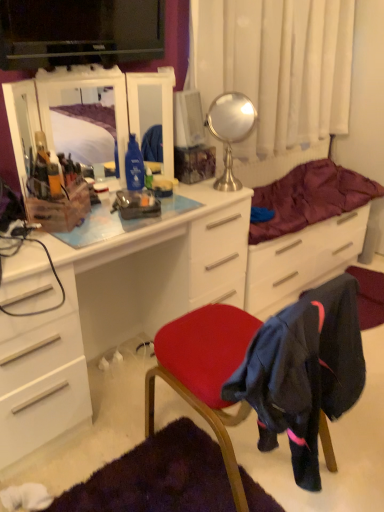
The width and height of the screenshot is (384, 512). What are the coordinates of `velvet red chair at center` in the screenshot? It's located at (268, 373).

This screenshot has height=512, width=384. What do you see at coordinates (79, 32) in the screenshot?
I see `matte black television at upper center` at bounding box center [79, 32].

Image resolution: width=384 pixels, height=512 pixels. What do you see at coordinates (230, 131) in the screenshot?
I see `polished silver mirror at upper center, the second mirror viewed from the left` at bounding box center [230, 131].

Measure the distance between matte plastic mirror at upper left, which is the 1th mirror in left-to-right order, and camera.

matte plastic mirror at upper left, which is the 1th mirror in left-to-right order, is 4.60 feet from camera.

Locate an element on the screen. velvet red chair at center is located at coordinates (268, 373).

Is matte black television at upper center not inside white glossy chest of drawers at center?

Absolutely, matte black television at upper center is external to white glossy chest of drawers at center.

Is matte black television at upper center positioned with its back to white glossy chest of drawers at center?

No, matte black television at upper center's orientation is not away from white glossy chest of drawers at center.

How much distance is there between matte black television at upper center and white glossy chest of drawers at center?

32.30 inches.

Is matte black television at upper center closer to the viewer compared to white glossy chest of drawers at center?

No, matte black television at upper center is further to the viewer.

Which of these two, maroon quilted blanket at center or white glossy chest of drawers at center, is smaller?

With smaller size is maroon quilted blanket at center.

This screenshot has width=384, height=512. In order to click on bedding above the white glossy chest of drawers at center (from the image's perspective) in this screenshot , I will do `click(310, 198)`.

Is maroon quilted blanket at center in front of or behind white glossy chest of drawers at center in the image?

In the image, maroon quilted blanket at center appears behind white glossy chest of drawers at center.

Considering the relative sizes of maroon quilted blanket at center and white glossy chest of drawers at center in the image provided, is maroon quilted blanket at center taller than white glossy chest of drawers at center?

No, maroon quilted blanket at center is not taller than white glossy chest of drawers at center.

Consider the image. From a real-world perspective, between velvet red chair at center and white glossy chest of drawers at center, who is vertically higher?

velvet red chair at center, from a real-world perspective.

Considering the relative positions of velvet red chair at center and white glossy chest of drawers at center in the image provided, is velvet red chair at center in front of white glossy chest of drawers at center?

That is True.

Between velvet red chair at center and white glossy chest of drawers at center, which one has larger size?

white glossy chest of drawers at center is bigger.

Between white sheer curtain at upper center and matte black television at upper center, which one has less height?

matte black television at upper center is shorter.

Relative to matte black television at upper center, is white sheer curtain at upper center in front or behind?

Visually, white sheer curtain at upper center is located behind matte black television at upper center.

From a real-world perspective, is white sheer curtain at upper center located higher than matte black television at upper center?

No.

Is white sheer curtain at upper center surrounding matte black television at upper center?

Actually, matte black television at upper center is outside white sheer curtain at upper center.

From the image's perspective, between matte black television at upper center and maroon quilted blanket at center, who is located below?

maroon quilted blanket at center.

Is matte black television at upper center with maroon quilted blanket at center?

matte black television at upper center and maroon quilted blanket at center are clearly separated.

Can you tell me how much matte black television at upper center and maroon quilted blanket at center differ in facing direction?

matte black television at upper center and maroon quilted blanket at center are facing 15 degrees away from each other.

Considering the sizes of matte black television at upper center and maroon quilted blanket at center in the image, is matte black television at upper center taller or shorter than maroon quilted blanket at center?

In the image, matte black television at upper center appears to be taller than maroon quilted blanket at center.

Is polished silver mirror at upper center, placed as the 1th mirror when sorted from right to left, positioned with its back to matte plastic mirror at upper left, the 2th mirror viewed from the right?

polished silver mirror at upper center, placed as the 1th mirror when sorted from right to left, is not turned away from matte plastic mirror at upper left, the 2th mirror viewed from the right.

The image size is (384, 512). I want to click on mirror lying on the right of matte plastic mirror at upper left, which is the 1th mirror in left-to-right order, so click(x=230, y=131).

Is polished silver mirror at upper center, the second mirror viewed from the left, next to matte plastic mirror at upper left, the 2th mirror viewed from the right?

polished silver mirror at upper center, the second mirror viewed from the left, is not next to matte plastic mirror at upper left, the 2th mirror viewed from the right, and they're not touching.

From the image's perspective, is polished silver mirror at upper center, the second mirror viewed from the left, above or below matte plastic mirror at upper left, which is the 1th mirror in left-to-right order?

Clearly, from the image's perspective, polished silver mirror at upper center, the second mirror viewed from the left, is above matte plastic mirror at upper left, which is the 1th mirror in left-to-right order.

Does white sheer curtain at upper center appear on the right side of polished silver mirror at upper center, placed as the 1th mirror when sorted from right to left?

Yes.

Is white sheer curtain at upper center taller or shorter than polished silver mirror at upper center, placed as the 1th mirror when sorted from right to left?

Considering their sizes, white sheer curtain at upper center has more height than polished silver mirror at upper center, placed as the 1th mirror when sorted from right to left.

Measure the distance from white sheer curtain at upper center to polished silver mirror at upper center, the second mirror viewed from the left.

white sheer curtain at upper center and polished silver mirror at upper center, the second mirror viewed from the left, are 15.36 inches apart.

Locate an element on the screen. This screenshot has height=512, width=384. the chest of drawers that is under the matte black television at upper center (from a real-world perspective) is located at coordinates (115, 309).

Where is `bedding behind the white glossy chest of drawers at center`? This screenshot has height=512, width=384. bedding behind the white glossy chest of drawers at center is located at coordinates (310, 198).

Based on their spatial positions, is maroon quilted blanket at center or white sheer curtain at upper center closer to polished silver mirror at upper center, the second mirror viewed from the left?

The object closer to polished silver mirror at upper center, the second mirror viewed from the left, is white sheer curtain at upper center.

Based on their spatial positions, is polished silver mirror at upper center, placed as the 1th mirror when sorted from right to left, or matte black television at upper center further from maroon quilted blanket at center?

matte black television at upper center lies further to maroon quilted blanket at center than the other object.

Looking at the image, which one is located further to velvet red chair at center, maroon quilted blanket at center or white sheer curtain at upper center?

white sheer curtain at upper center.

Considering their positions, is white glossy chest of drawers at center positioned closer to white sheer curtain at upper center than matte black television at upper center?

The object closer to white sheer curtain at upper center is matte black television at upper center.

Looking at the image, which one is located closer to white sheer curtain at upper center, matte plastic mirror at upper left, the 2th mirror viewed from the right, or velvet red chair at center?

matte plastic mirror at upper left, the 2th mirror viewed from the right, lies closer to white sheer curtain at upper center than the other object.

Which object lies nearer to the anchor point white glossy chest of drawers at center, matte plastic mirror at upper left, which is the 1th mirror in left-to-right order, or white sheer curtain at upper center?

Based on the image, matte plastic mirror at upper left, which is the 1th mirror in left-to-right order, appears to be nearer to white glossy chest of drawers at center.

Considering their positions, is maroon quilted blanket at center positioned further to polished silver mirror at upper center, placed as the 1th mirror when sorted from right to left, than velvet red chair at center?

velvet red chair at center is further to polished silver mirror at upper center, placed as the 1th mirror when sorted from right to left.

Estimate the real-world distances between objects in this image. Which object is further from matte plastic mirror at upper left, which is the 1th mirror in left-to-right order, polished silver mirror at upper center, the second mirror viewed from the left, or maroon quilted blanket at center?

Based on the image, maroon quilted blanket at center appears to be further to matte plastic mirror at upper left, which is the 1th mirror in left-to-right order.

Locate an element on the screen. chest of drawers between velvet red chair at center and maroon quilted blanket at center from front to back is located at coordinates (115, 309).

Where is `bedding that lies between white sheer curtain at upper center and white glossy chest of drawers at center from top to bottom`? The image size is (384, 512). bedding that lies between white sheer curtain at upper center and white glossy chest of drawers at center from top to bottom is located at coordinates (310, 198).

Locate an element on the screen. This screenshot has height=512, width=384. television between matte plastic mirror at upper left, which is the 1th mirror in left-to-right order, and maroon quilted blanket at center is located at coordinates (79, 32).

Find the location of a particular element. The image size is (384, 512). television between white sheer curtain at upper center and velvet red chair at center in the up-down direction is located at coordinates (79, 32).